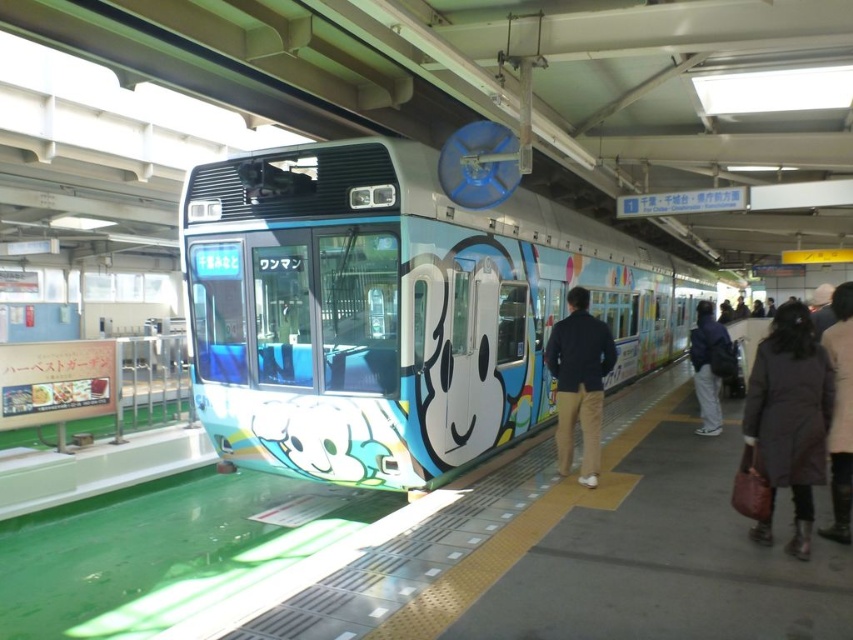
You are a passenger waiting at the train station platform. You see the matte blue train at center and the brown quilted coat at right. Which object is positioned closer to the platform edge?

The brown quilted coat at right is closer to the platform edge because the matte blue train at center is to the right of it, meaning the coat is positioned to the left side of the train and closer to the edge.

You are a passenger waiting on the train station platform. You have a brown leather bag at lower right and light gray pants at right. Which item is closer to you?

The brown leather bag at lower right is closer to you because it is in front of the light gray pants at right.

You are standing on the train station platform and want to determine the relative positions of two points marked on the platform. Which point is closer to you, the point at coordinate [579,324] or the point at [848,417]?

Point [579,324] is closer to you because it is further to the viewer than point [848,417].